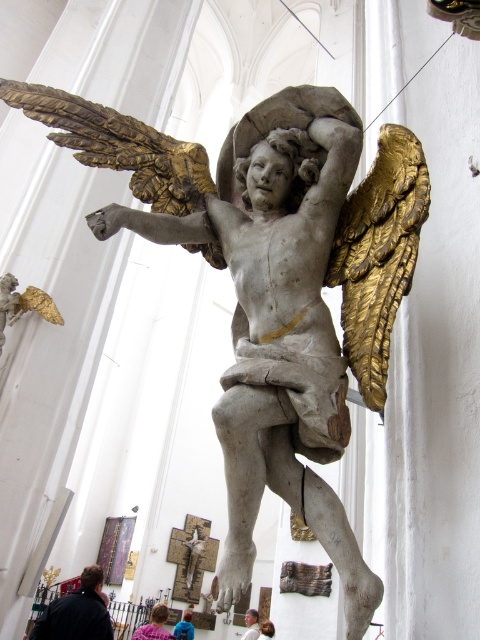
How distant is blue fabric child at lower center from blue denim jacket at lower center?

blue fabric child at lower center is 4.07 meters from blue denim jacket at lower center.

In the scene shown: Does blue fabric child at lower center have a greater height compared to blue denim jacket at lower center?

Correct, blue fabric child at lower center is much taller as blue denim jacket at lower center.

Does point (156, 604) lie behind point (189, 616)?

That is True.

Find the location of a particular element. This screenshot has height=640, width=480. blue fabric child at lower center is located at coordinates (155, 625).

Which is in front, point (72, 589) or point (268, 637)?

Positioned in front is point (268, 637).

Is dark brown leather jacket at lower left positioned in front of blonde hair at lower center?

Yes, it is.

Is point (60, 605) closer to viewer compared to point (263, 637)?

Yes, point (60, 605) is closer to viewer.

This screenshot has width=480, height=640. What are the coordinates of `dark brown leather jacket at lower left` in the screenshot? It's located at (76, 612).

Is dark brown leather jacket at lower left wider than blue fabric child at lower center?

Yes, dark brown leather jacket at lower left is wider than blue fabric child at lower center.

Is dark brown leather jacket at lower left to the right of blue fabric child at lower center from the viewer's perspective?

No, dark brown leather jacket at lower left is not to the right of blue fabric child at lower center.

Where is `dark brown leather jacket at lower left`? The height and width of the screenshot is (640, 480). dark brown leather jacket at lower left is located at coordinates (76, 612).

Where is `dark brown leather jacket at lower left`? The width and height of the screenshot is (480, 640). dark brown leather jacket at lower left is located at coordinates (76, 612).